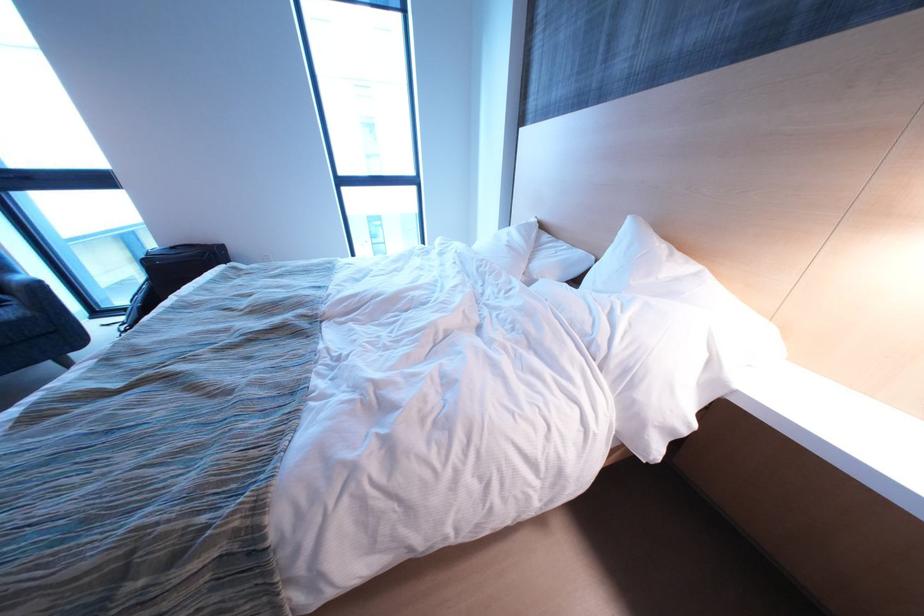
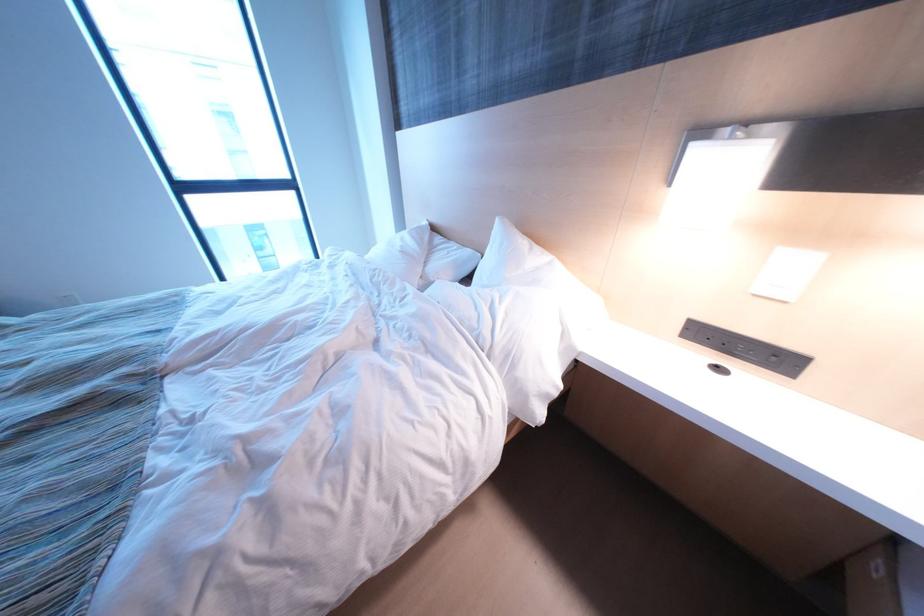
Question: The images are taken continuously from a first-person perspective. In which direction are you moving?

Choices:
 (A) Left
 (B) Right
 (C) Forward
 (D) Backward

Answer: (B)